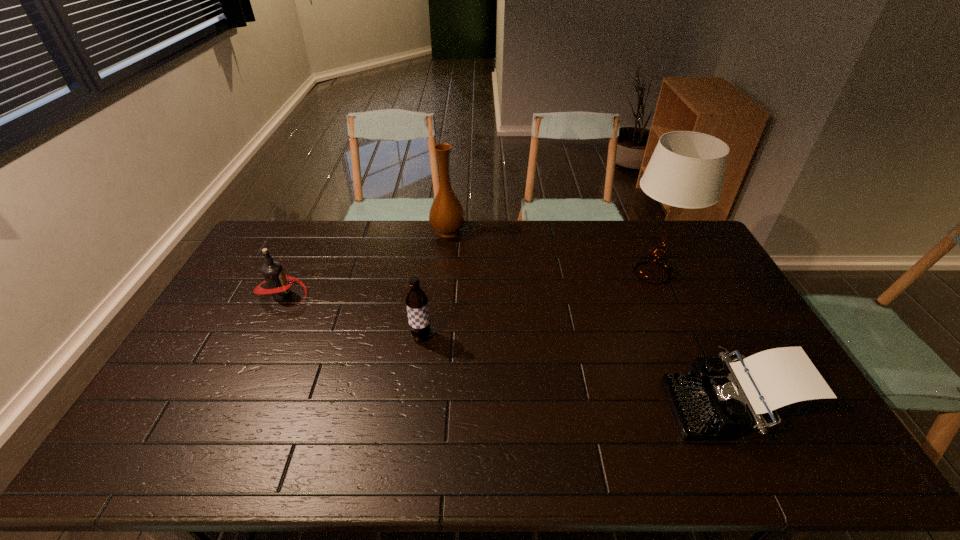
Locate an element on the screen. The width and height of the screenshot is (960, 540). object present at the near edge is located at coordinates (719, 397).

Where is `object that is at the left edge`? This screenshot has width=960, height=540. object that is at the left edge is located at coordinates (277, 281).

Locate an element on the screen. This screenshot has height=540, width=960. table lamp present at the right edge is located at coordinates pos(686,170).

At what (x,y) coordinates should I click in order to perform the action: click on typewriter at the right edge. Please return your answer as a coordinate pair (x, y). This screenshot has height=540, width=960. Looking at the image, I should click on (719, 397).

Where is `object present at the far right corner`? This screenshot has width=960, height=540. object present at the far right corner is located at coordinates [686, 170].

Find the location of a particular element. object located at the near right corner is located at coordinates tap(719, 397).

Locate an element on the screen. vacant point at the far edge is located at coordinates (538, 249).

The height and width of the screenshot is (540, 960). Find the location of `free space at the left edge of the desktop`. free space at the left edge of the desktop is located at coordinates (252, 322).

Where is `vacant space at the near left corner of the desktop`? This screenshot has width=960, height=540. vacant space at the near left corner of the desktop is located at coordinates (175, 436).

In the image, there is a desktop. Identify the location of free space at the far right corner. This screenshot has height=540, width=960. (658, 221).